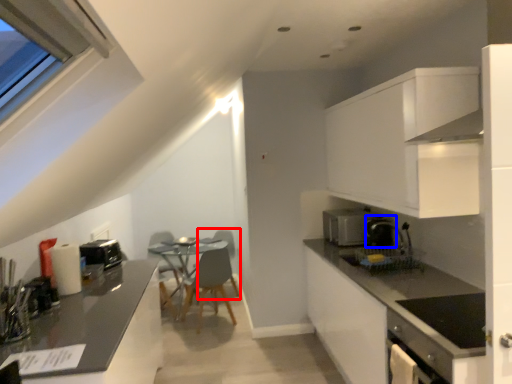
Question: Which point is further to the camera, armchair (highlighted by a red box) or coffee machine (highlighted by a blue box)?

Choices:
 (A) armchair
 (B) coffee machine

Answer: (A)